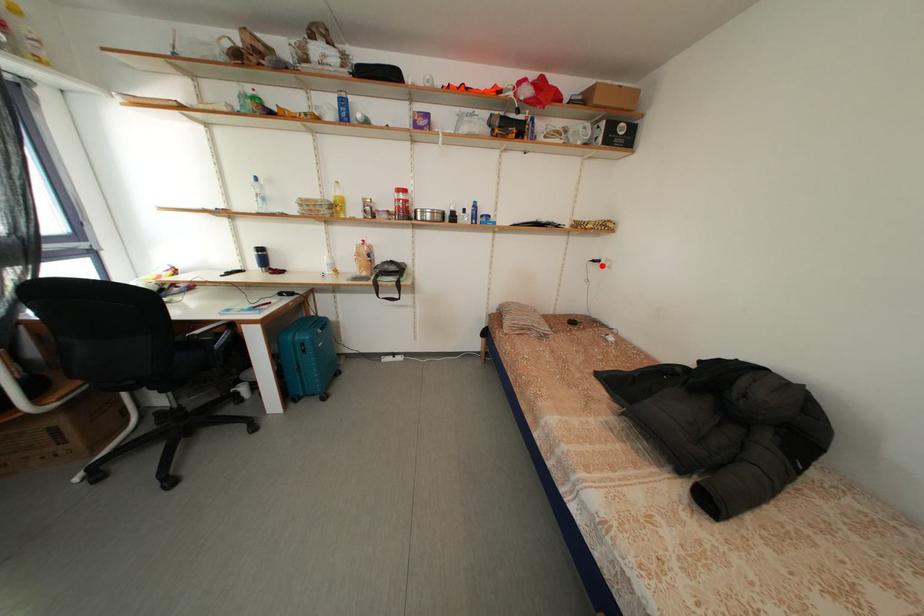
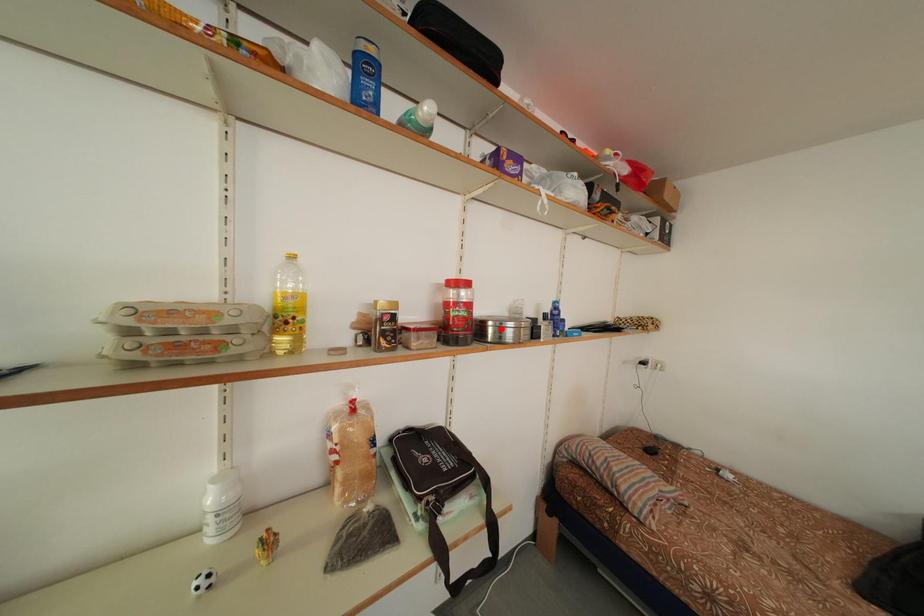
I am providing you with two images of the same scene from different viewpoints. A red point is marked on the first image and another point is marked on the second image. Is the red point in image1 aligned with the point shown in image2?

No